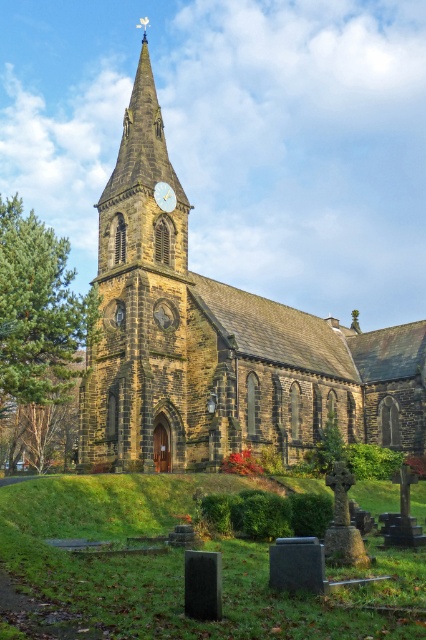
Question: Is brown stone church at center to the left of gold metallic clock at center from the viewer's perspective?

Choices:
 (A) no
 (B) yes

Answer: (A)

Question: Which object appears farthest from the camera in this image?

Choices:
 (A) gold metallic clock at center
 (B) green leafy tree at left

Answer: (A)

Question: Can you confirm if brown stone church at center is positioned above gold metallic clock at center?

Choices:
 (A) yes
 (B) no

Answer: (A)

Question: Which point appears farthest from the camera in this image?

Choices:
 (A) (143, 140)
 (B) (141, 68)
 (C) (155, 193)

Answer: (B)

Question: Can you confirm if brown stone church at center is positioned above green leafy tree at left?

Choices:
 (A) yes
 (B) no

Answer: (A)

Question: Which object is positioned closest to the green leafy tree at left?

Choices:
 (A) gold metallic clock at center
 (B) brown stone church at center
 (C) brown stone clock tower at center

Answer: (C)